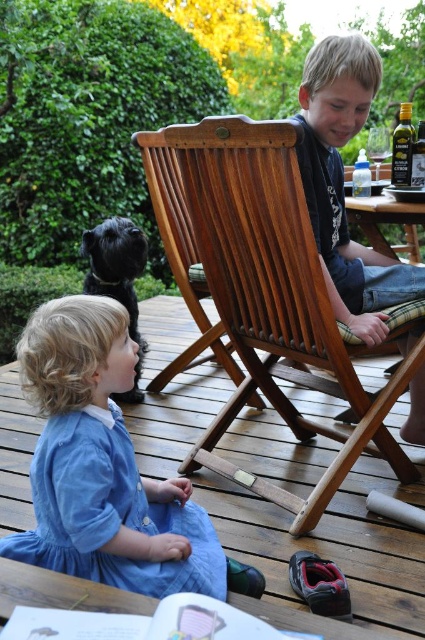
You are a photographer trying to capture a candid shot of the wooden chair at center and the black shiny dog at left. From your current position, which object is positioned lower in the frame?

The wooden chair at center is positioned lower in the frame than the black shiny dog at left.

You are a delivery robot that needs to place a small package between the wooden chair at center and the black shiny dog at left. The package requires 60 centimeters of space. Can you fit it there?

The wooden chair at center and black shiny dog at left are 75.21 centimeters apart from each other. Since the required space is 60 centimeters, the package can be placed there as there is enough space between them.